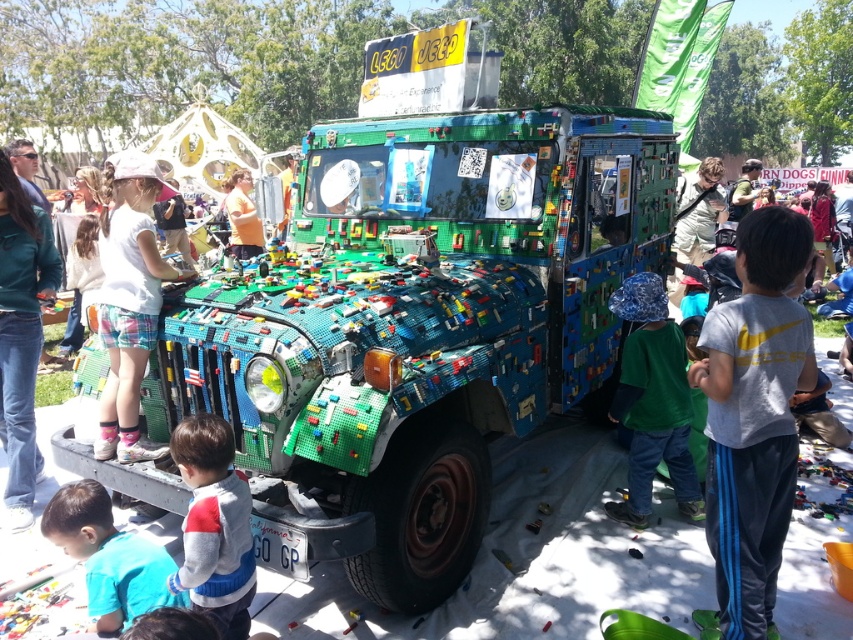
You are a photographer at the LEGO event. You need to capture a photo of the blue sweater at lower left and orange shirt at center. Which clothing item is shorter in height?

The blue sweater at lower left is shorter than the orange shirt at center.

You are standing at the center of the image. There is a point labeled as point (108,557). What object is located at that point?

The point (108,557) corresponds to the blue sweater at lower left.

You are a photographer standing in front of the LEGO Jeep. You want to take a photo that includes both the multicolored plastic blocks at center and the gray sweater at lower left. Which object should you focus on first to ensure both are in the frame?

You should focus on the multicolored plastic blocks at center first because it is closer to you than the gray sweater at lower left, so adjusting the frame to include it will naturally include the sweater in the background.